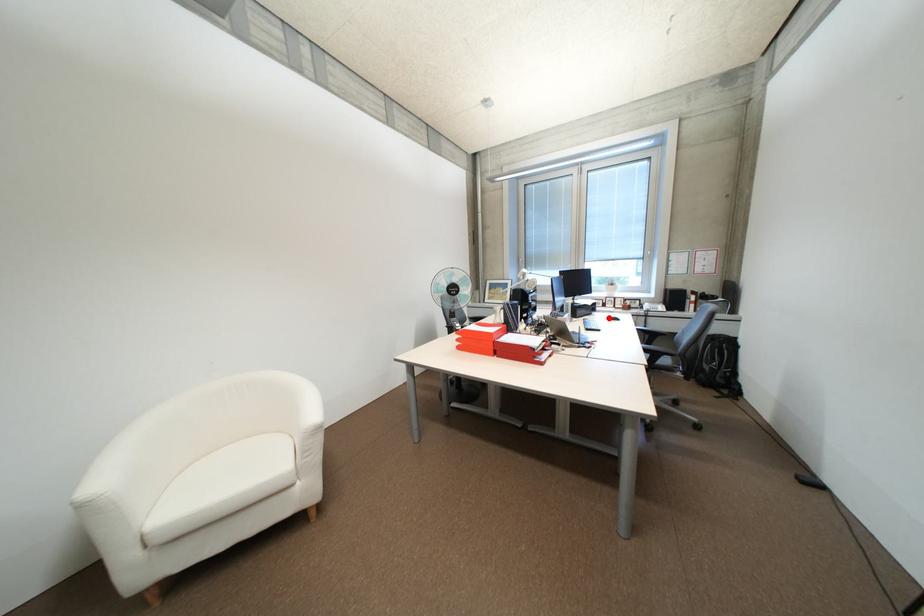
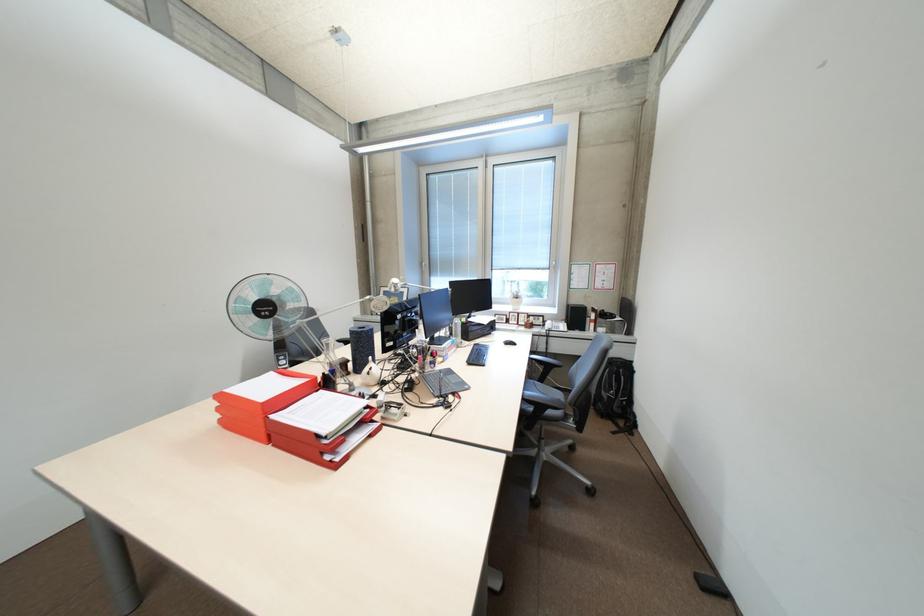
In the second image, find the point that corresponds to the highlighted location in the first image.

(504, 341)